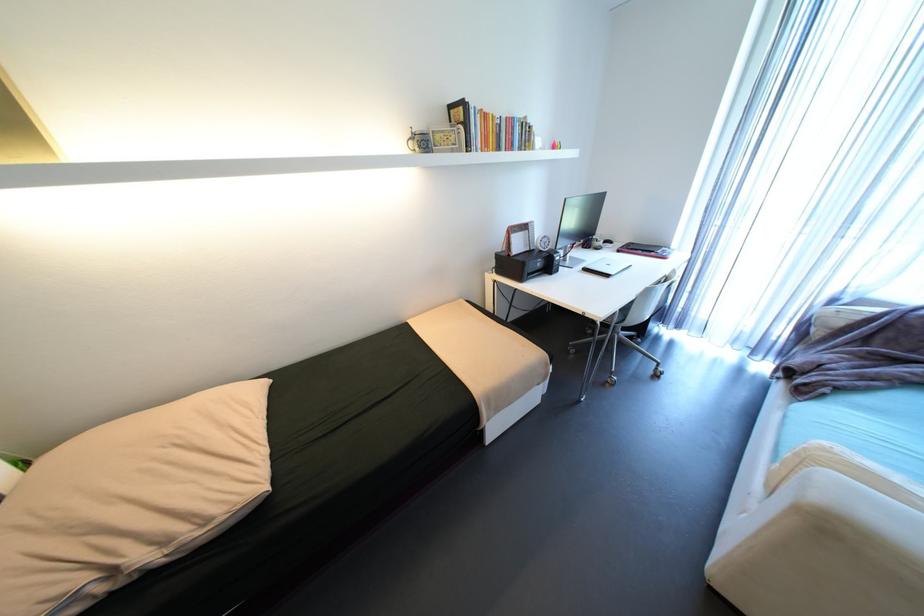
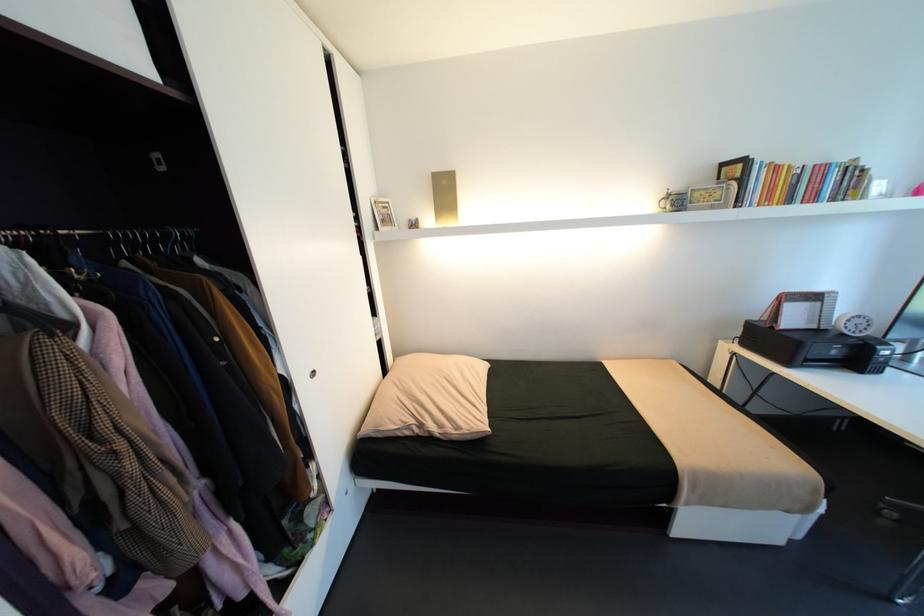
Locate, in the second image, the point that corresponds to point (442, 138) in the first image.

(700, 196)